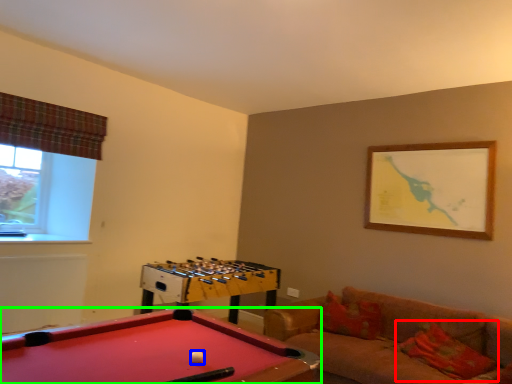
Question: Which object is positioned closest to pillow (highlighted by a red box)? Select from ball (highlighted by a blue box) and billiard table (highlighted by a green box).

Choices:
 (A) ball
 (B) billiard table

Answer: (B)